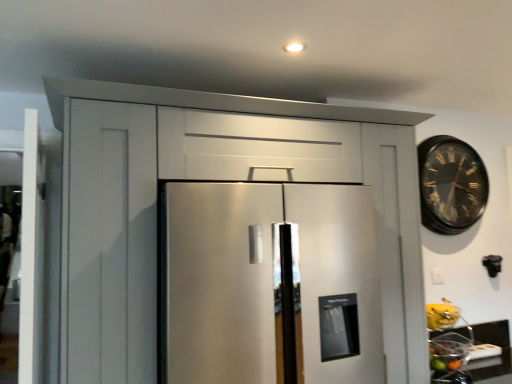
Question: From the image's perspective, would you say shiny metallic bowl at lower right, the first fruit when ordered from bottom to top, is shown under yellow matte bananas at lower right, the first fruit in the top-to-bottom sequence?

Choices:
 (A) no
 (B) yes

Answer: (B)

Question: From a real-world perspective, is shiny metallic bowl at lower right, which ranks as the second fruit in top-to-bottom order, on yellow matte bananas at lower right, the first fruit in the top-to-bottom sequence?

Choices:
 (A) yes
 (B) no

Answer: (B)

Question: Is shiny metallic bowl at lower right, which ranks as the second fruit in top-to-bottom order, smaller than yellow matte bananas at lower right, the 2th fruit when ordered from bottom to top?

Choices:
 (A) no
 (B) yes

Answer: (B)

Question: Considering the relative positions of shiny metallic bowl at lower right, the first fruit when ordered from bottom to top, and yellow matte bananas at lower right, the first fruit in the top-to-bottom sequence, in the image provided, is shiny metallic bowl at lower right, the first fruit when ordered from bottom to top, to the left of yellow matte bananas at lower right, the first fruit in the top-to-bottom sequence, from the viewer's perspective?

Choices:
 (A) yes
 (B) no

Answer: (A)

Question: Does shiny metallic bowl at lower right, which ranks as the second fruit in top-to-bottom order, have a greater height compared to yellow matte bananas at lower right, the first fruit in the top-to-bottom sequence?

Choices:
 (A) yes
 (B) no

Answer: (B)

Question: Is shiny metallic bowl at lower right, which ranks as the second fruit in top-to-bottom order, positioned far away from yellow matte bananas at lower right, the first fruit in the top-to-bottom sequence?

Choices:
 (A) yes
 (B) no

Answer: (B)

Question: Is matte black countertop at lower right taller than gold-toned metal clock at upper right?

Choices:
 (A) no
 (B) yes

Answer: (A)

Question: Is matte black countertop at lower right at the right side of gold-toned metal clock at upper right?

Choices:
 (A) no
 (B) yes

Answer: (B)

Question: From the image's perspective, does matte black countertop at lower right appear lower than gold-toned metal clock at upper right?

Choices:
 (A) yes
 (B) no

Answer: (A)

Question: Could you tell me if matte black countertop at lower right is facing gold-toned metal clock at upper right?

Choices:
 (A) yes
 (B) no

Answer: (B)

Question: Is the position of matte black countertop at lower right more distant than that of gold-toned metal clock at upper right?

Choices:
 (A) no
 (B) yes

Answer: (A)

Question: Can you confirm if matte black countertop at lower right is smaller than gold-toned metal clock at upper right?

Choices:
 (A) no
 (B) yes

Answer: (B)

Question: Is matte black countertop at lower right outside of yellow matte bananas at lower right, the first fruit in the top-to-bottom sequence?

Choices:
 (A) no
 (B) yes

Answer: (B)